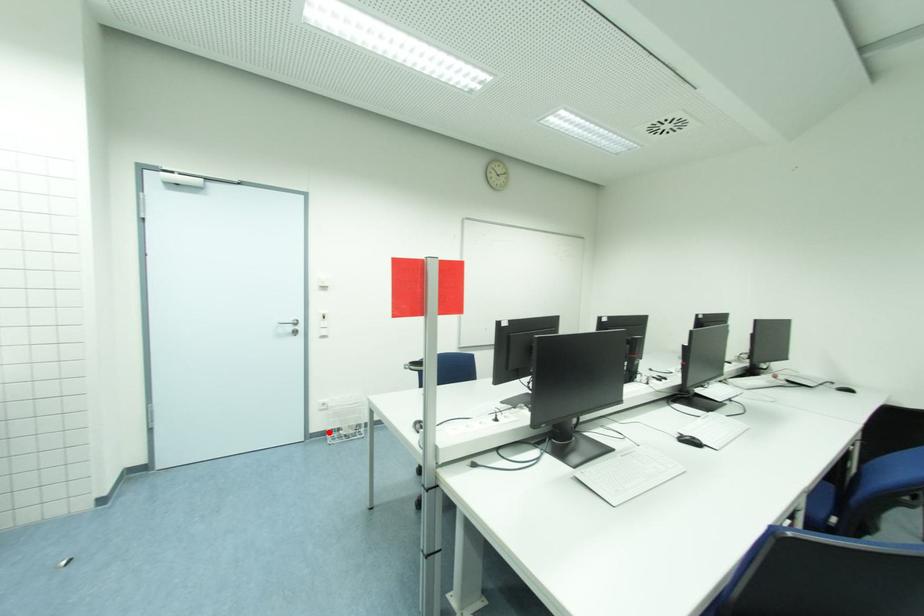
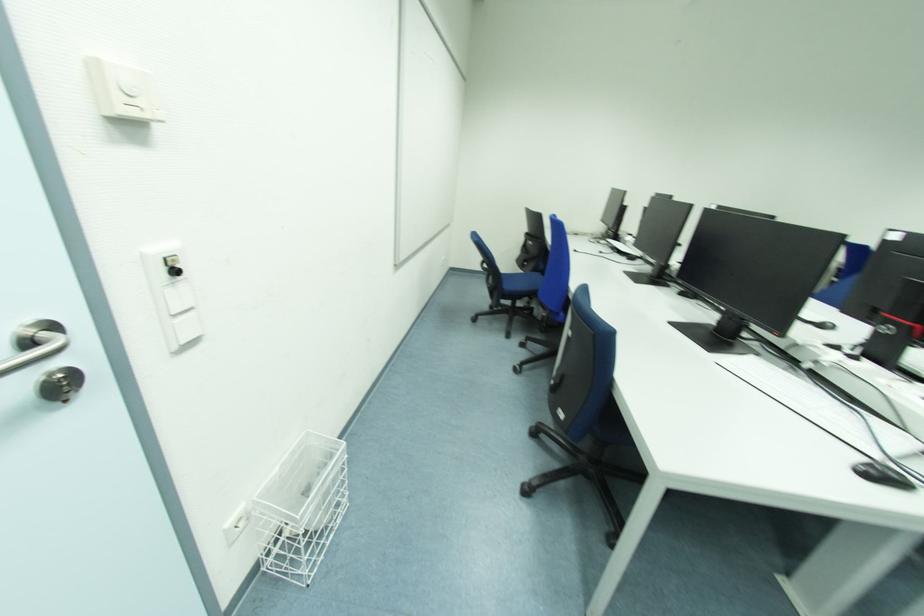
The point at the highlighted location is marked in the first image. Where is the corresponding point in the second image?

(261, 564)